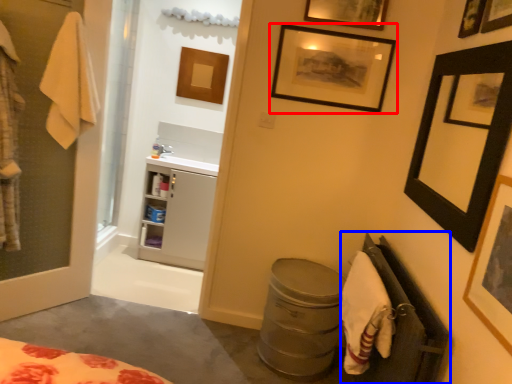
Question: Which of the following is the closest to the observer, picture frame (highlighted by a red box) or closet (highlighted by a blue box)?

Choices:
 (A) picture frame
 (B) closet

Answer: (B)